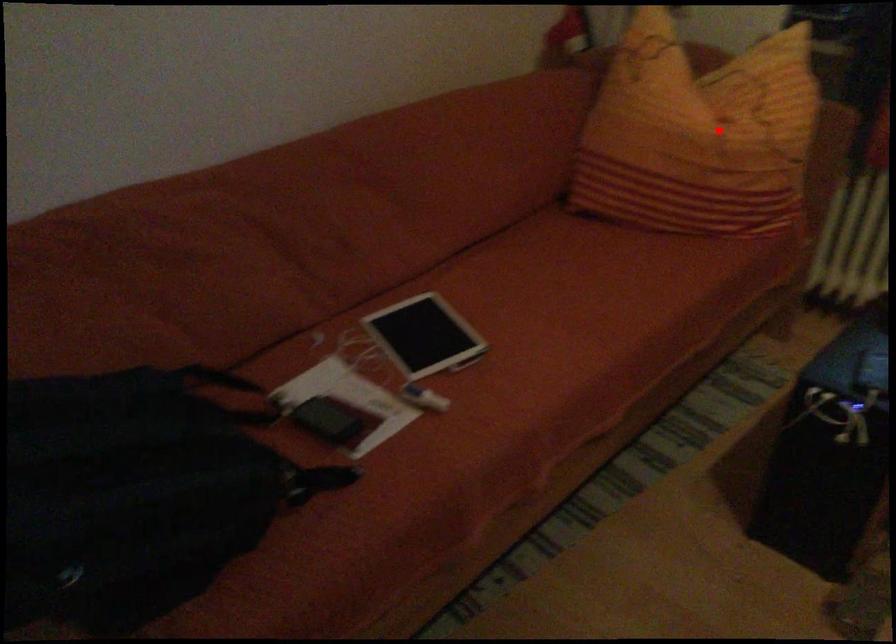
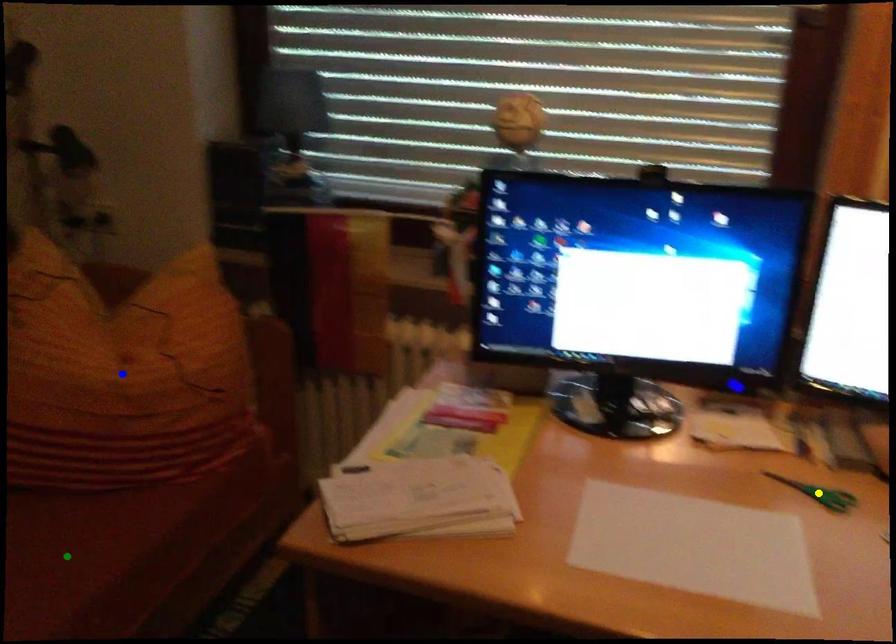
Question: I am providing you with two images of the same scene from different viewpoints. A red point is marked on the first image. You are given multiple points on the second image. Which spot in image 2 lines up with the point in image 1?

Choices:
 (A) yellow point
 (B) blue point
 (C) green point

Answer: (B)